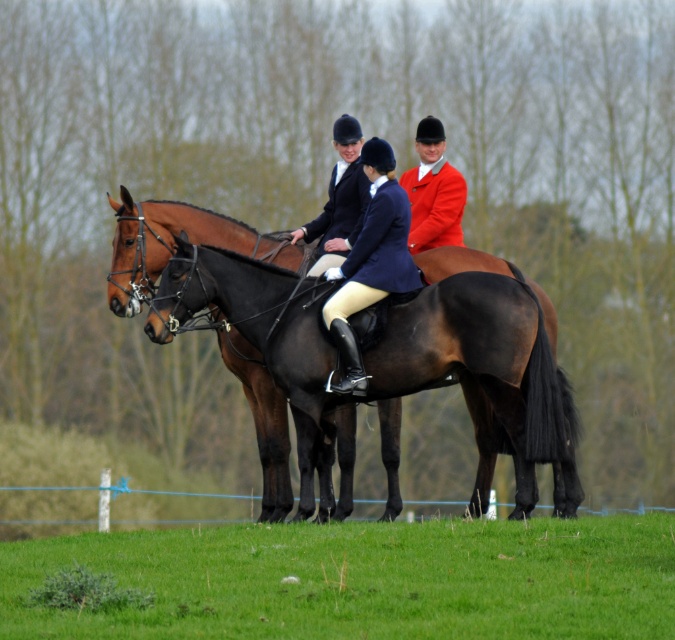
You are a photographer positioned at the edge of the field where the riders are. You want to take a photo focusing on the brown glossy horse at center without the matte black jacket at center being visible in the background. Is the current arrangement possible based on their positions?

The brown glossy horse at center is in front of the matte black jacket at center, so yes, the current arrangement allows the photographer to take a photo focusing on the brown glossy horse at center without the matte black jacket at center being visible in the background.

Based on the photo, you are a photographer standing at the edge of the grassy field where the brown glossy horse at center is located. You want to take a clear photo of the horse without moving closer. Based on the distance between you and the horse, what is the minimum focal length lens you should use if your camera sensor size is 36mm and you want the horse to occupy 20mm of the sensor?

The minimum focal length lens required is approximately 36 meters times 20mm divided by the sensor size of 36mm, resulting in 36.54 meters times 20mm divided by 36mm equals approximately 19.7 meters. Wait, that doesn not make sense. Maybe I need to use the formula focal length equals distance multiplied by sensor size divided by subject size on sensor. Let me think again. If the subject occupies 20mm on the sensor, then focal length equals distance multiplied by subject size divided by sensor size? Hmm, I m

You are a drone operator trying to capture a photo of the green grass at lower center. The drone is currently at coordinates point A. To ensure the grass is in the center of the photo, where should you move the drone relative to the grass?

The green grass at lower center is located at point [362,579]. To center it in the photo, move the drone to that coordinate.